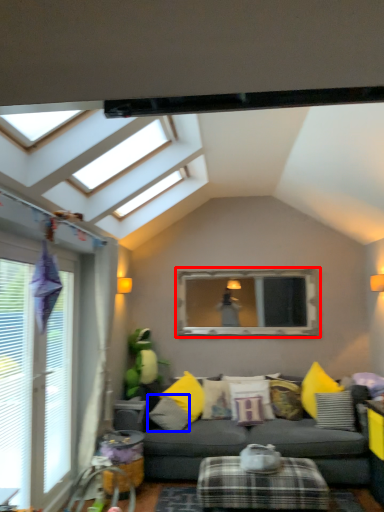
Question: Among these objects, which one is farthest to the camera, bay window (highlighted by a red box) or pillow (highlighted by a blue box)?

Choices:
 (A) bay window
 (B) pillow

Answer: (A)